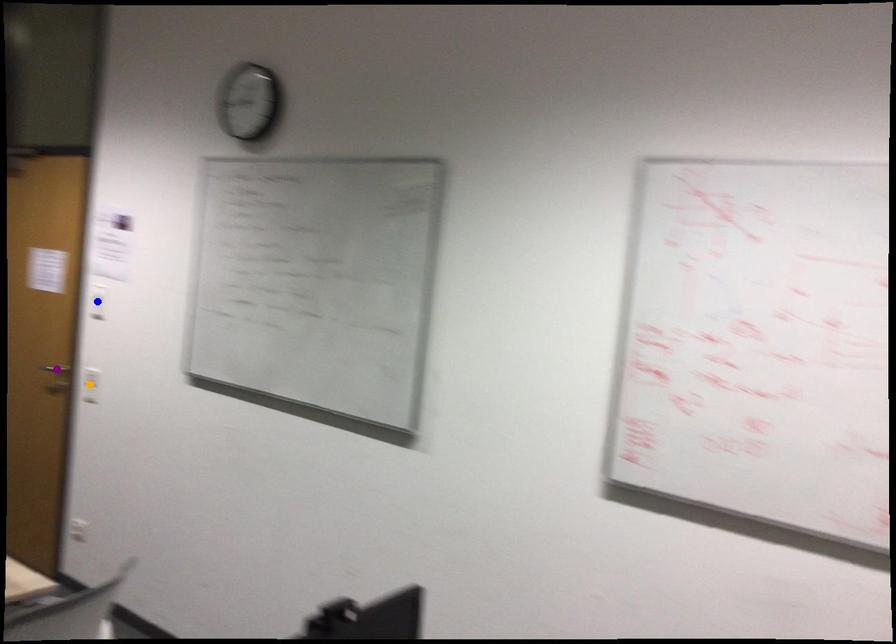
Order these from nearest to farthest:
1. purple point
2. blue point
3. orange point

1. purple point
2. orange point
3. blue point